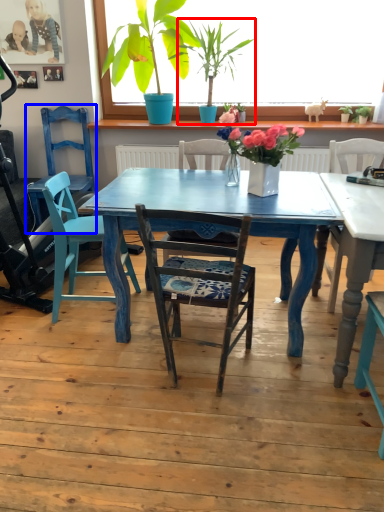
Question: Which object appears farthest to the camera in this image, houseplant (highlighted by a red box) or armchair (highlighted by a blue box)?

Choices:
 (A) houseplant
 (B) armchair

Answer: (B)